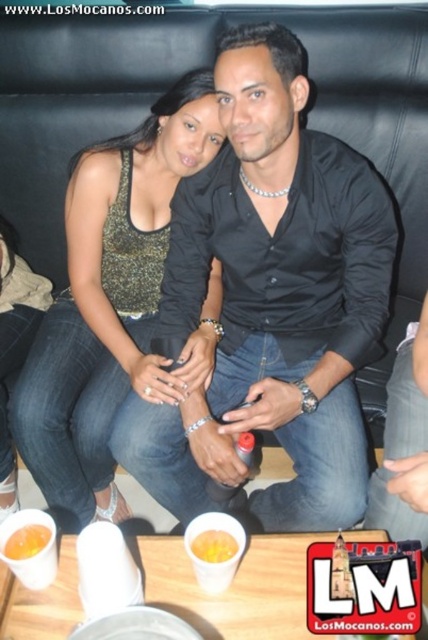
Does shiny gold tank top at center appear over translucent plastic cup at lower left?

Yes.

Does point (115, 518) lie in front of point (48, 538)?

No, it is behind (48, 538).

Is point (74, 480) positioned before point (12, 531)?

That is False.

Where is `shiny gold tank top at center`? shiny gold tank top at center is located at coordinates (109, 300).

Can you confirm if black satin shirt at center is positioned below shiny gold tank top at center?

Incorrect, black satin shirt at center is not positioned below shiny gold tank top at center.

From the picture: Between black satin shirt at center and shiny gold tank top at center, which one is positioned lower?

shiny gold tank top at center

Where is `black satin shirt at center`? The image size is (428, 640). black satin shirt at center is located at coordinates (285, 280).

At what (x,y) coordinates should I click in order to perform the action: click on black satin shirt at center. Please return your answer as a coordinate pair (x, y). Image resolution: width=428 pixels, height=640 pixels. Looking at the image, I should click on (285, 280).

Which is more to the left, translucent plastic cup at lower left or yellow matte cup at center?

From the viewer's perspective, translucent plastic cup at lower left appears more on the left side.

Is translucent plastic cup at lower left smaller than yellow matte cup at center?

No, translucent plastic cup at lower left is not smaller than yellow matte cup at center.

I want to click on translucent plastic cup at lower left, so click(x=26, y=541).